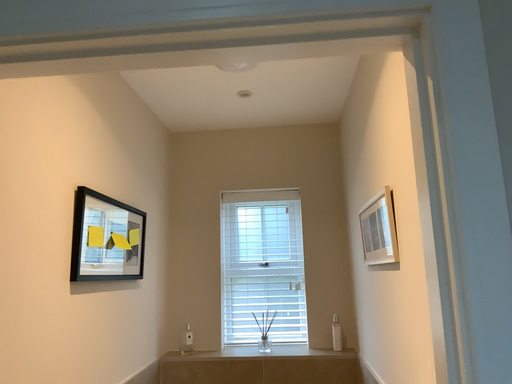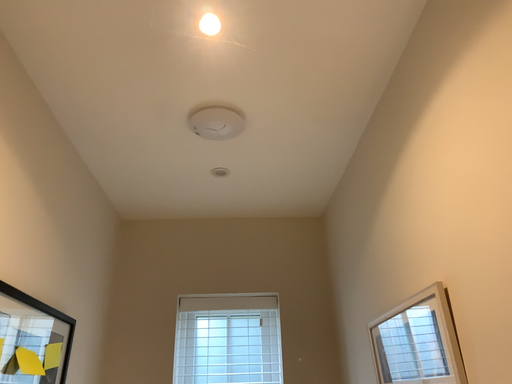
Question: Which way did the camera rotate in the video?

Choices:
 (A) rotated right
 (B) rotated left

Answer: (A)